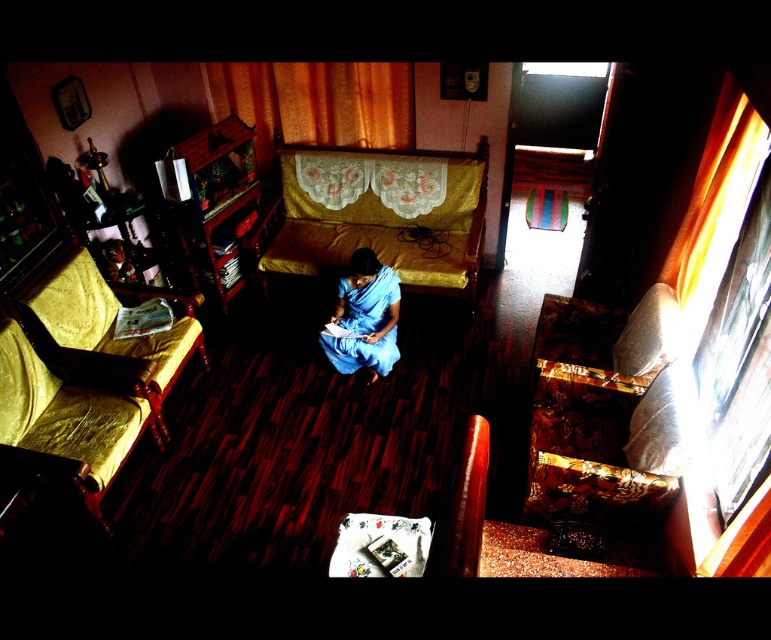
Question: Is gold/yellow fabric couch at center above blue silk saree at center?

Choices:
 (A) no
 (B) yes

Answer: (B)

Question: Which of these objects is positioned closest to the wooden bunk bed at left?

Choices:
 (A) blue silk saree at center
 (B) gold/yellow fabric couch at center

Answer: (B)

Question: Does gold fabric couch at left have a larger size compared to wooden bunk bed at left?

Choices:
 (A) no
 (B) yes

Answer: (B)

Question: Which is nearer to the gold fabric couch at left?

Choices:
 (A) blue silk saree at center
 (B) gold/yellow fabric couch at center
 (C) wooden bunk bed at left

Answer: (C)

Question: Which object is closer to the camera taking this photo?

Choices:
 (A) blue silk saree at center
 (B) gold/yellow fabric couch at center
 (C) wooden bunk bed at left
 (D) gold fabric couch at left

Answer: (D)

Question: Is gold fabric couch at left wider than wooden bunk bed at left?

Choices:
 (A) yes
 (B) no

Answer: (A)